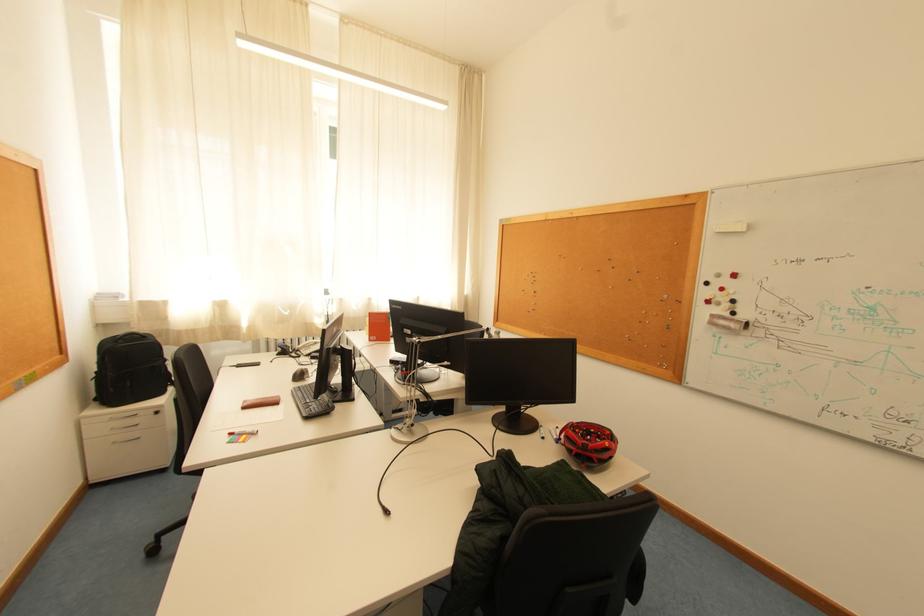
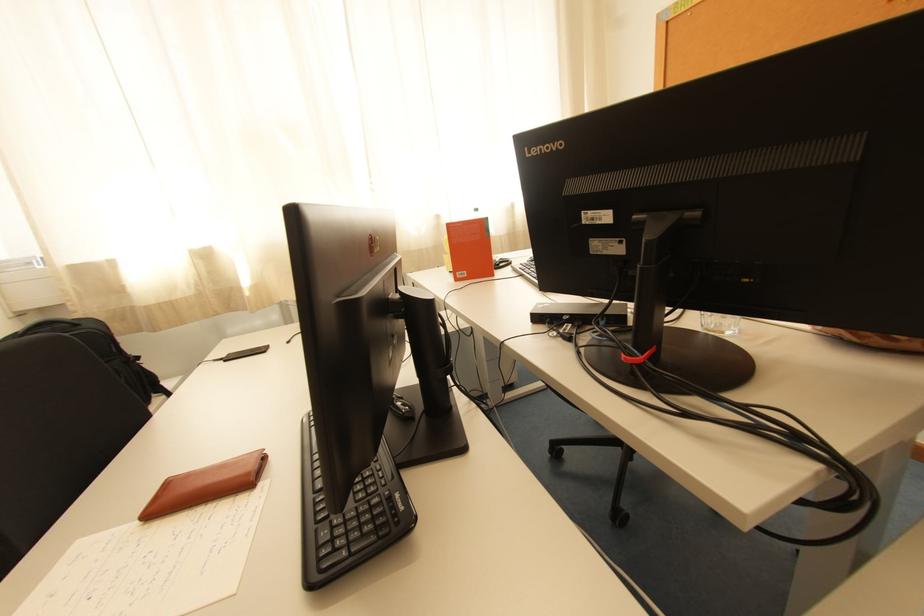
Which direction would the cameraman need to move to produce the second image?

The cameraman walked toward left, forward.